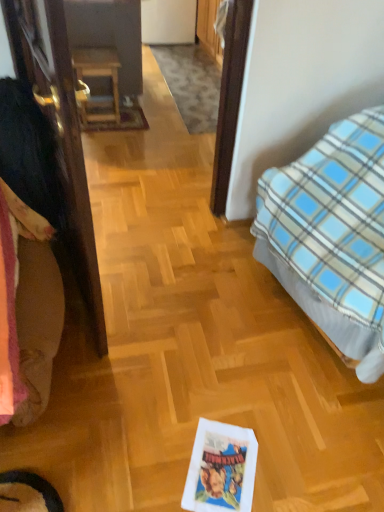
Image resolution: width=384 pixels, height=512 pixels. I want to click on blue plaid blanket at right, so click(x=332, y=234).

In order to face blue plaid blanket at right, should I rotate leftwards or rightwards?

Turn right approximately 27.026 degrees to face it.

Image resolution: width=384 pixels, height=512 pixels. Describe the element at coordinates (98, 76) in the screenshot. I see `wooden table at center` at that location.

What is the approximate width of brown wooden door at left?

4.88 inches.

Locate an element on the screen. blue plaid blanket at right is located at coordinates (332, 234).

Is blue plaid blanket at right wider or thinner than brown wooden door at left?

In the image, blue plaid blanket at right appears to be wider than brown wooden door at left.

Is blue plaid blanket at right aimed at brown wooden door at left?

Yes, blue plaid blanket at right faces towards brown wooden door at left.

Is blue plaid blanket at right not near brown wooden door at left?

blue plaid blanket at right is near brown wooden door at left, not far away.

Would you say wooden table at center is inside or outside blue plaid blanket at right?

wooden table at center is spatially situated outside blue plaid blanket at right.

Which of these two, wooden table at center or blue plaid blanket at right, is bigger?

blue plaid blanket at right is bigger.

Does wooden table at center have a greater width compared to blue plaid blanket at right?

No, wooden table at center is not wider than blue plaid blanket at right.

Is wooden table at center oriented away from blue plaid blanket at right?

wooden table at center does not have its back to blue plaid blanket at right.

Considering the sizes of objects fluffy beige blanket at left and brown wooden door at left in the image provided, who is shorter, fluffy beige blanket at left or brown wooden door at left?

Standing shorter between the two is fluffy beige blanket at left.

Is fluffy beige blanket at left facing away from brown wooden door at left?

No, fluffy beige blanket at left's orientation is not away from brown wooden door at left.

You are a GUI agent. You are given a task and a screenshot of the screen. Output one action in this format:
    pyautogui.click(x=<x>, y=<y>)
    Task: Click on the door above the fluffy beige blanket at left (from the image's perspective)
    The height and width of the screenshot is (512, 384).
    Given the screenshot: What is the action you would take?
    60,133

How different are the orientations of fluffy beige blanket at left and brown wooden door at left in degrees?

14.5 degrees.

Is wooden table at center further to camera compared to brown wooden door at left?

Yes.

From the image's perspective, relative to brown wooden door at left, is wooden table at center above or below?

wooden table at center is situated higher than brown wooden door at left in the image.

Is wooden table at center positioned far away from brown wooden door at left?

Yes, wooden table at center and brown wooden door at left are quite far apart.

Can you confirm if wooden table at center is taller than brown wooden door at left?

No, wooden table at center is not taller than brown wooden door at left.

Is brown wooden door at left inside or outside of blue plaid blanket at right?

brown wooden door at left is spatially situated outside blue plaid blanket at right.

In the image, there is a brown wooden door at left. What are the coordinates of `bed below it (from the image's perspective)` in the screenshot? It's located at (332, 234).

Considering the sizes of objects brown wooden door at left and blue plaid blanket at right in the image provided, who is shorter, brown wooden door at left or blue plaid blanket at right?

With less height is blue plaid blanket at right.

Between fluffy beige blanket at left and wooden table at center, which one has less height?

With less height is wooden table at center.

Is the depth of fluffy beige blanket at left less than that of wooden table at center?

Yes, fluffy beige blanket at left is closer to the camera.

Is fluffy beige blanket at left facing towards wooden table at center?

No, fluffy beige blanket at left is not facing towards wooden table at center.

From a real-world perspective, which is physically above, fluffy beige blanket at left or wooden table at center?

In real-world perspective, wooden table at center is above.

Considering the points (362, 333) and (95, 61), which point is behind, point (362, 333) or point (95, 61)?

The point (95, 61) is more distant.

How different are the orientations of blue plaid blanket at right and wooden table at center in degrees?

The angle between the facing direction of blue plaid blanket at right and the facing direction of wooden table at center is 82.4 degrees.

Is the surface of blue plaid blanket at right in direct contact with wooden table at center?

No, blue plaid blanket at right is not beside wooden table at center.

Consider the image. From a real-world perspective, which is physically above, blue plaid blanket at right or wooden table at center?

In real-world perspective, blue plaid blanket at right is above.

Find the location of a particular element. door located on the left of blue plaid blanket at right is located at coordinates (60, 133).

Image resolution: width=384 pixels, height=512 pixels. In the image, there is a wooden table at center. What are the coordinates of `bed below it (from the image's perspective)` in the screenshot? It's located at (332, 234).

Estimate the real-world distances between objects in this image. Which object is closer to brown wooden door at left, fluffy beige blanket at left or wooden table at center?

The object closer to brown wooden door at left is fluffy beige blanket at left.

From the image, which object appears to be nearer to fluffy beige blanket at left, blue plaid blanket at right or brown wooden door at left?

The object closer to fluffy beige blanket at left is brown wooden door at left.

From the picture: Based on their spatial positions, is fluffy beige blanket at left or blue plaid blanket at right closer to brown wooden door at left?

fluffy beige blanket at left is closer to brown wooden door at left.

Estimate the real-world distances between objects in this image. Which object is further from brown wooden door at left, wooden table at center or fluffy beige blanket at left?

wooden table at center is further to brown wooden door at left.

Estimate the real-world distances between objects in this image. Which object is further from blue plaid blanket at right, brown wooden door at left or wooden table at center?

Based on the image, wooden table at center appears to be further to blue plaid blanket at right.

Considering their positions, is wooden table at center positioned further to brown wooden door at left than blue plaid blanket at right?

Among the two, wooden table at center is located further to brown wooden door at left.

Considering their positions, is wooden table at center positioned closer to fluffy beige blanket at left than blue plaid blanket at right?

The object closer to fluffy beige blanket at left is blue plaid blanket at right.

Estimate the real-world distances between objects in this image. Which object is further from fluffy beige blanket at left, wooden table at center or brown wooden door at left?

wooden table at center is further to fluffy beige blanket at left.

This screenshot has height=512, width=384. What are the coordinates of `bedding between blue plaid blanket at right and wooden table at center from front to back` in the screenshot? It's located at (27, 309).

Where is `door between fluffy beige blanket at left and blue plaid blanket at right in the horizontal direction`? This screenshot has width=384, height=512. door between fluffy beige blanket at left and blue plaid blanket at right in the horizontal direction is located at coordinates (60, 133).

Identify the location of bedding between brown wooden door at left and wooden table at center along the z-axis. (27, 309).

Identify the location of door between blue plaid blanket at right and wooden table at center in the front-back direction. (60, 133).